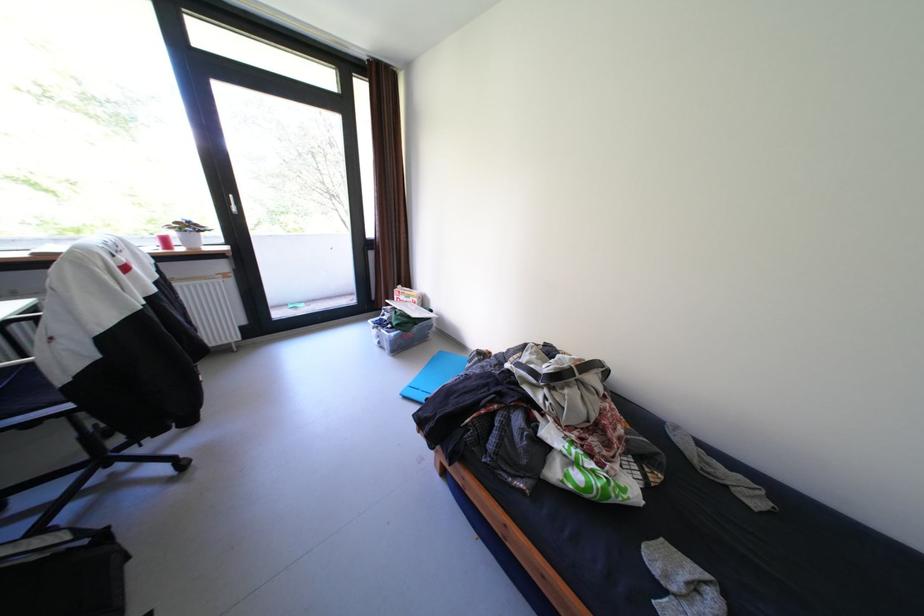
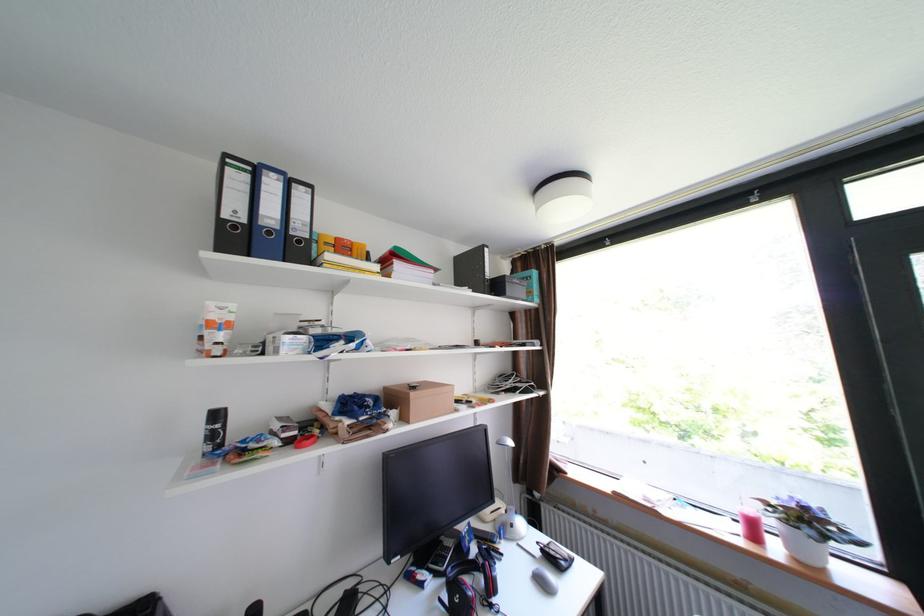
In the second image, find the point that corresponds to pixel 186 236 in the first image.

(782, 523)